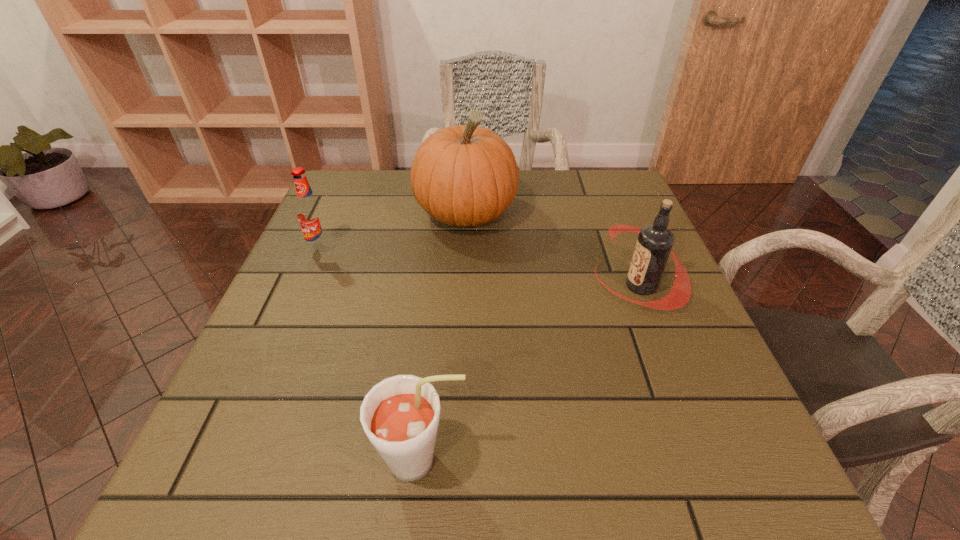
Identify the location of the tallest object. The height and width of the screenshot is (540, 960). (465, 175).

At what (x,y) coordinates should I click in order to perform the action: click on the rightmost object. Please return your answer as a coordinate pair (x, y). This screenshot has height=540, width=960. Looking at the image, I should click on (654, 244).

In order to click on the second nearest root beer in this screenshot , I will do `click(654, 244)`.

At what (x,y) coordinates should I click in order to perform the action: click on the farthest root beer. Please return your answer as a coordinate pair (x, y). Looking at the image, I should click on (310, 214).

Find the location of a particular element. the leftmost object is located at coordinates (310, 214).

Identify the location of the nearest object. The height and width of the screenshot is (540, 960). click(x=400, y=415).

You are a GUI agent. You are given a task and a screenshot of the screen. Output one action in this format:
    pyautogui.click(x=<x>, y=<y>)
    Task: Click on the second root beer from right to left
    This screenshot has height=540, width=960.
    Given the screenshot: What is the action you would take?
    (400, 415)

This screenshot has height=540, width=960. Identify the location of free location located 0.220m on the stem of the tallest object. (462, 312).

Find the location of a particular element. The image size is (960, 540). vacant space located on the label of the rightmost root beer is located at coordinates (437, 286).

Where is `vacant space located on the label of the rightmost root beer`? vacant space located on the label of the rightmost root beer is located at coordinates (573, 286).